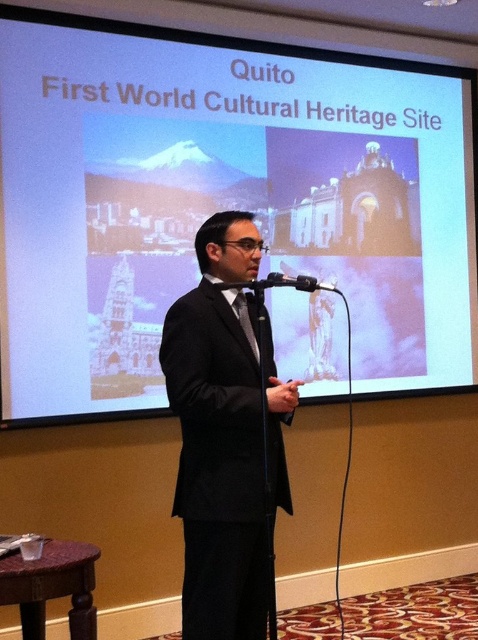
Question: Which point is closer to the camera taking this photo?

Choices:
 (A) (424, 227)
 (B) (311, 282)
 (C) (221, 496)

Answer: (C)

Question: Can you confirm if white matte projection screen at upper center is bigger than black satin tie at center?

Choices:
 (A) yes
 (B) no

Answer: (A)

Question: Does black matte microphone at center appear on the right side of black satin tie at center?

Choices:
 (A) yes
 (B) no

Answer: (A)

Question: Considering the real-world distances, which object is closest to the brown wood stool at lower left?

Choices:
 (A) black satin tie at center
 (B) white matte projection screen at upper center

Answer: (A)

Question: Considering the real-world distances, which object is closest to the black matte microphone at center?

Choices:
 (A) black satin tie at center
 (B) black suit at center
 (C) white matte projection screen at upper center

Answer: (C)

Question: Is black suit at center below black satin tie at center?

Choices:
 (A) no
 (B) yes

Answer: (B)